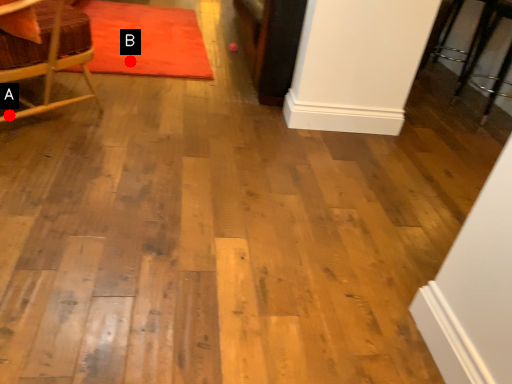
Question: Two points are circled on the image, labeled by A and B beside each circle. Which of the following is the farthest from the observer?

Choices:
 (A) A is further
 (B) B is further

Answer: (B)